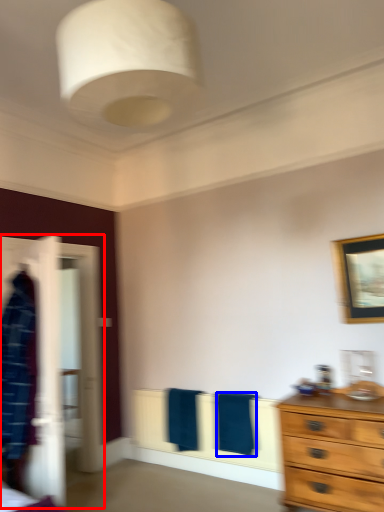
Question: Which object appears closest to the camera in this image, closet (highlighted by a red box) or bath towel (highlighted by a blue box)?

Choices:
 (A) closet
 (B) bath towel

Answer: (A)